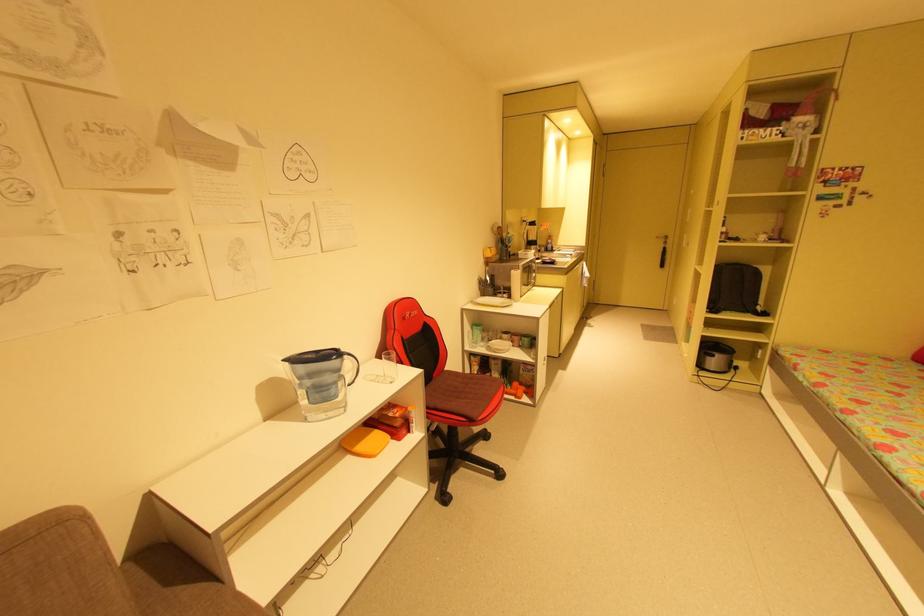
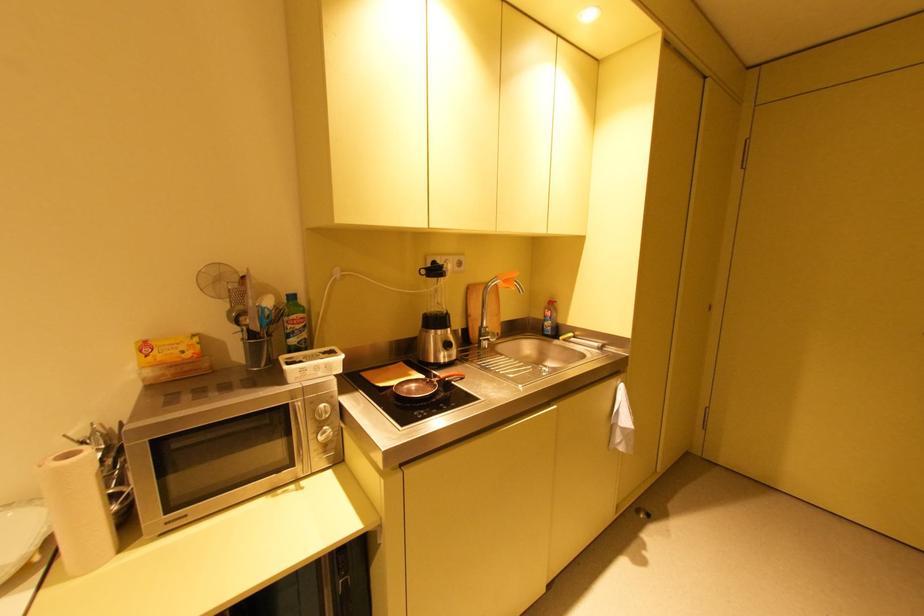
The point at [494,251] is marked in the first image. Where is the corresponding point in the second image?

(150, 347)